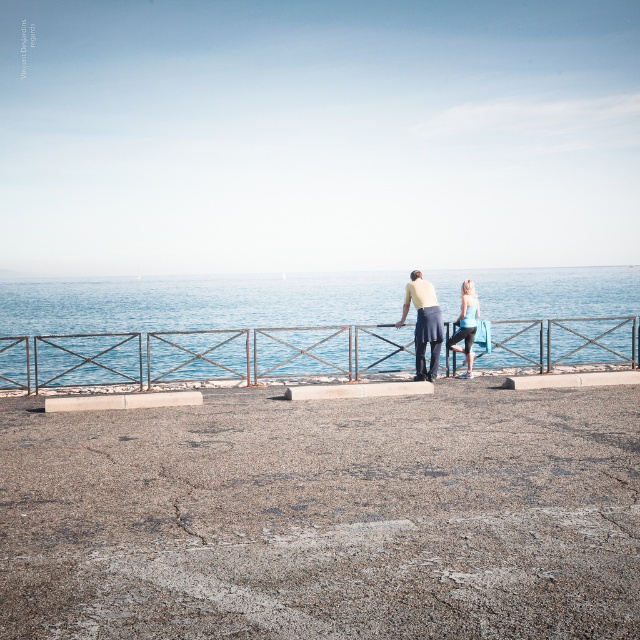
Does matte yellow shirt at center lie in front of blue fabric leggings at center?

Yes, it is.

What do you see at coordinates (422, 323) in the screenshot?
I see `matte yellow shirt at center` at bounding box center [422, 323].

This screenshot has width=640, height=640. In order to click on matte yellow shirt at center in this screenshot , I will do `click(422, 323)`.

Between blue water at center and matte yellow shirt at center, which one appears on the left side from the viewer's perspective?

From the viewer's perspective, blue water at center appears more on the left side.

Can you confirm if blue water at center is taller than matte yellow shirt at center?

Yes, blue water at center is taller than matte yellow shirt at center.

Does point (88, 332) come in front of point (419, 276)?

No, it is not.

Where is `blue water at center`? The image size is (640, 640). blue water at center is located at coordinates (221, 321).

Does smooth concrete ground at center appear over blue fabric leggings at center?

Incorrect, smooth concrete ground at center is not positioned above blue fabric leggings at center.

Describe the element at coordinates (324, 516) in the screenshot. Image resolution: width=640 pixels, height=640 pixels. I see `smooth concrete ground at center` at that location.

Between point (212, 480) and point (465, 348), which one is positioned in front?

Point (212, 480)

At what (x,y) coordinates should I click in order to perform the action: click on smooth concrete ground at center. Please return your answer as a coordinate pair (x, y). Looking at the image, I should click on (324, 516).